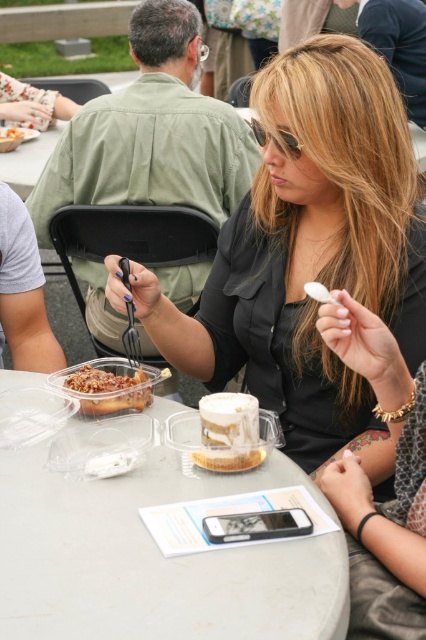
You are at the coordinates point 0.877, 0.364. Is the white plastic table at center located at your current position?

The white plastic table at center is located at point (155, 561), so yes, the table is at your current position.